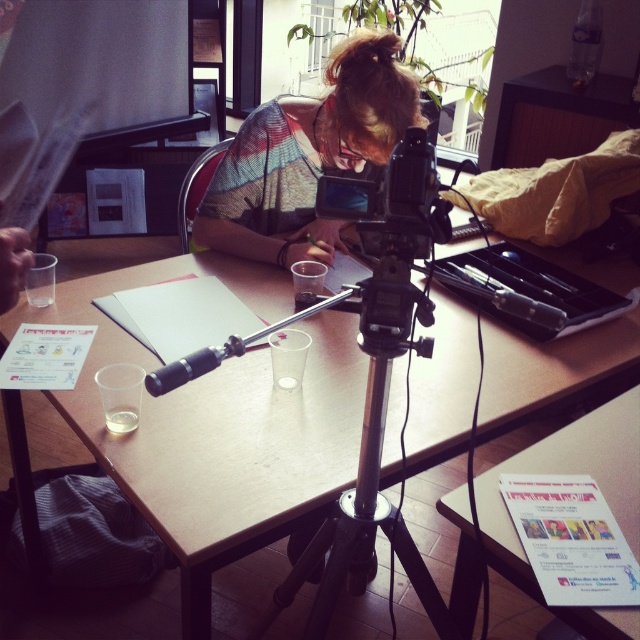
Does point (628, 419) lie in front of point (362, 444)?

No, it is behind (362, 444).

Between white paper at lower right and silver metallic tripod at center, which one has more height?

silver metallic tripod at center

Does point (620, 419) come farther from viewer compared to point (451, 634)?

That is True.

Find the location of a particular element. The width and height of the screenshot is (640, 640). white paper at lower right is located at coordinates (600, 488).

Is wooden table at center to the left of black plastic camera at center from the viewer's perspective?

No, wooden table at center is not to the left of black plastic camera at center.

Is point (204, 506) farther from viewer compared to point (413, 166)?

Yes, it is.

The height and width of the screenshot is (640, 640). I want to click on wooden table at center, so click(218, 426).

Which is in front, point (248, 243) or point (433, 156)?

Point (433, 156) is more forward.

Is knitted sweater at center to the right of black plastic camera at center from the viewer's perspective?

In fact, knitted sweater at center is to the left of black plastic camera at center.

Identify the location of knitted sweater at center. (307, 156).